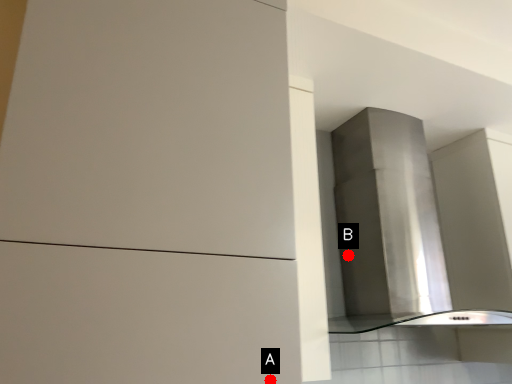
Question: Two points are circled on the image, labeled by A and B beside each circle. Which point appears farthest from the camera in this image?

Choices:
 (A) A is further
 (B) B is further

Answer: (B)